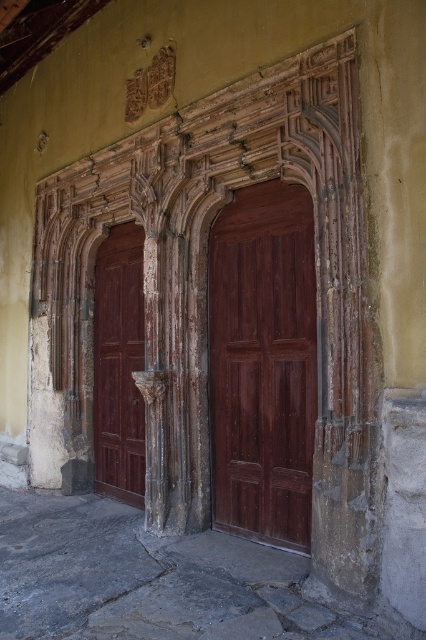
You are an architect examining the entrance. You notice the wooden carved archway at center and the matte wood door at center. Which object is positioned lower in the entrance?

The wooden carved archway at center is positioned lower than the matte wood door at center.